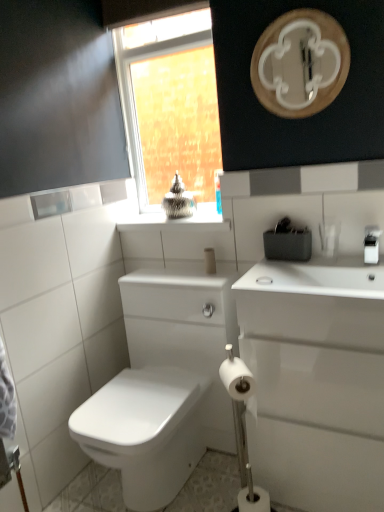
Find the location of a particular element. The width and height of the screenshot is (384, 512). free space to the left of white matte cylindrical container at center is located at coordinates (172, 278).